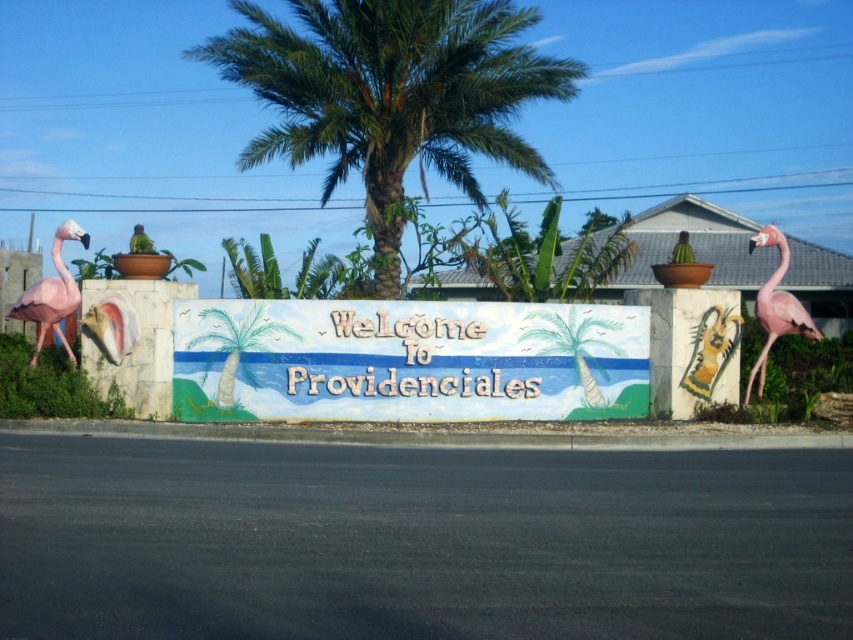
Is painted wooden signboard at center further to the viewer compared to pink matte flamingo at left?

Yes, painted wooden signboard at center is further from the viewer.

Is painted wooden signboard at center above pink matte flamingo at left?

No.

Identify the location of painted wooden signboard at center. This screenshot has width=853, height=640. (407, 360).

Looking at this image, does green leafy palm tree at center have a greater width compared to pink matte flamingo at right?

Correct, the width of green leafy palm tree at center exceeds that of pink matte flamingo at right.

Find the location of a particular element. This screenshot has height=640, width=853. green leafy palm tree at center is located at coordinates (392, 97).

Is point (366, 90) positioned behind point (779, 234)?

Yes, point (366, 90) is behind point (779, 234).

The width and height of the screenshot is (853, 640). Identify the location of green leafy palm tree at center. (392, 97).

Does pink matte flamingo at right have a greater height compared to pink matte flamingo at left?

No.

Is pink matte flamingo at right wider than pink matte flamingo at left?

In fact, pink matte flamingo at right might be narrower than pink matte flamingo at left.

Who is more distant from viewer, (775, 236) or (33, 364)?

The point (775, 236) is more distant.

What are the coordinates of `pink matte flamingo at right` in the screenshot? It's located at (776, 307).